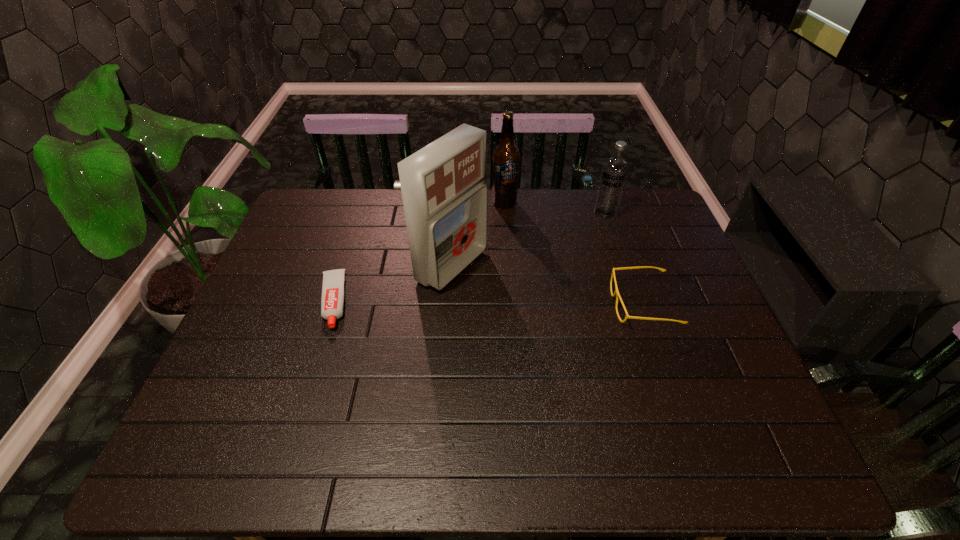
I want to click on free space that satisfies the following two spatial constraints: 1. on the front side of the second object from left to right; 2. in front of the lenses of the fourth tallest object, so click(x=449, y=304).

Locate an element on the screen. free location that satisfies the following two spatial constraints: 1. on the front side of the second object from left to right; 2. in front of the lenses of the spectacles is located at coordinates (449, 304).